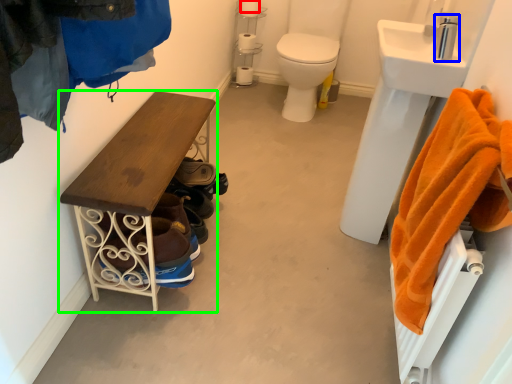
Question: Considering the real-world distances, which object is closest to toilet paper (highlighted by a red box)? faucet (highlighted by a blue box) or furniture (highlighted by a green box).

Choices:
 (A) faucet
 (B) furniture

Answer: (A)